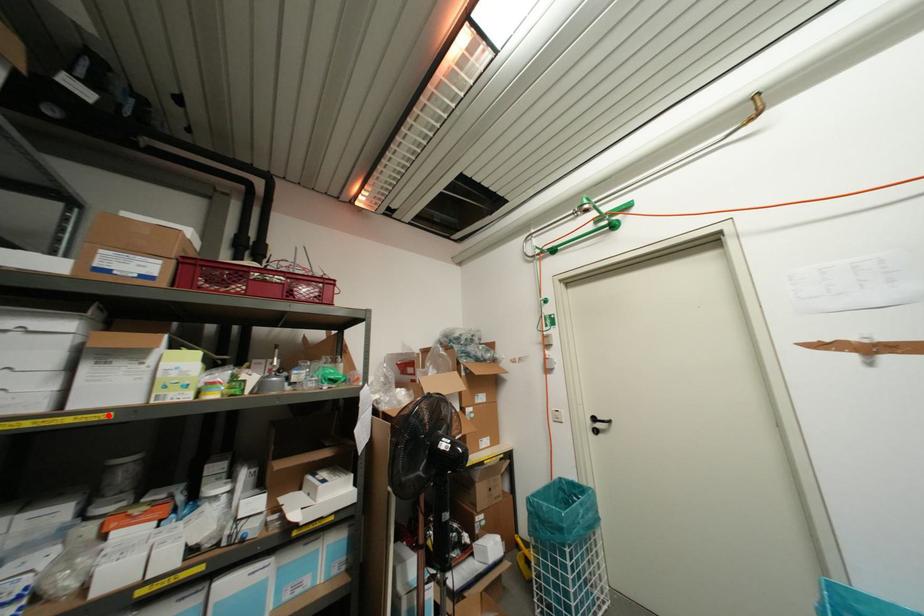
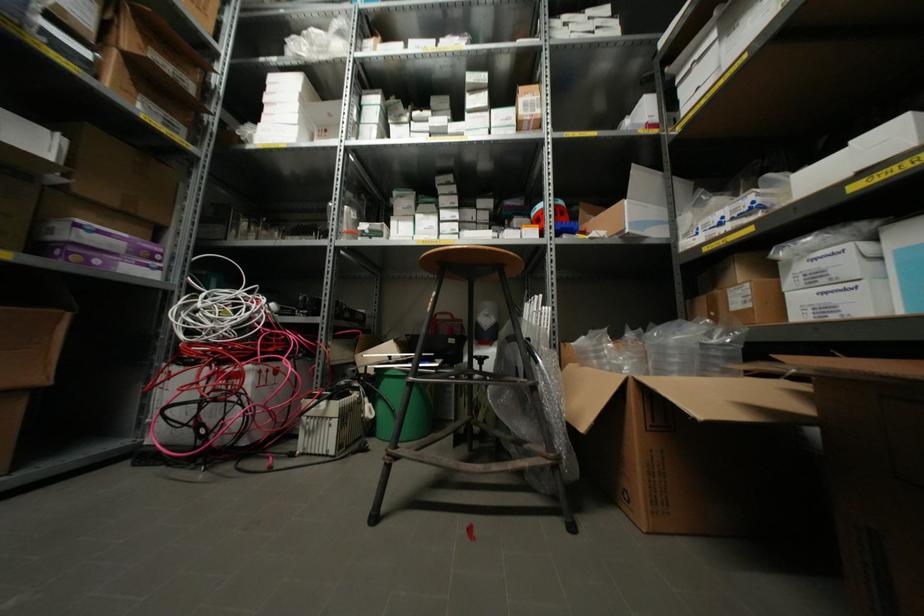
In the second image, find the point that corresponds to the highlighted location in the first image.

(743, 55)